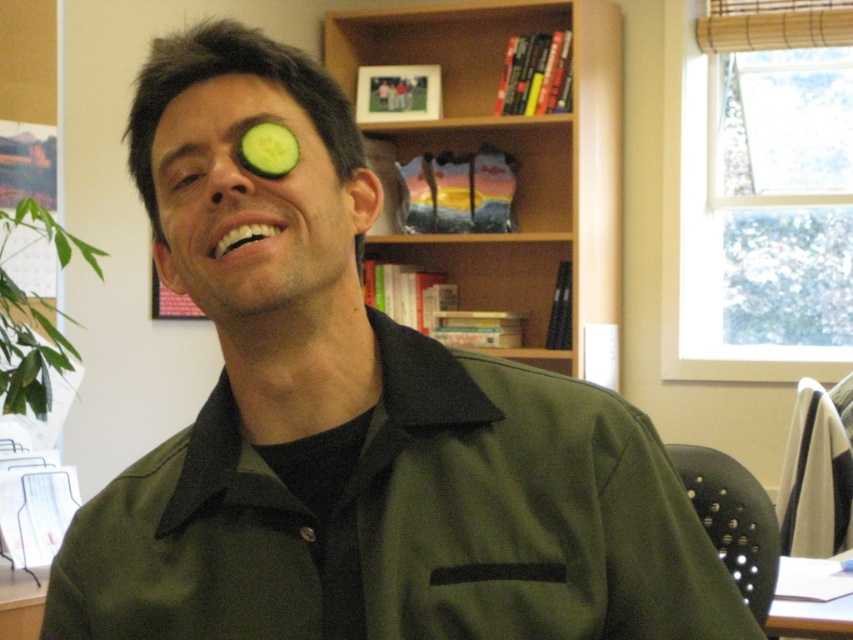
You are standing in an office and see a point marked at coordinates [250,205]. Based on the scene described, what object is located at that point?

The point at coordinates [250,205] corresponds to the green matte cucumber at upper left.

You are a photographer setting up for a photoshoot in this room. You need to ensure that the green smooth cucumber at left is visible in the shot without being blocked by the wooden bookshelf at upper center. Based on their positions, can you achieve this?

The wooden bookshelf at upper center is positioned over the green smooth cucumber at left, so if you place the camera at a lower angle, you can capture the cucumber while the bookshelf is above it and not blocking the view.

You are standing in the office and want to reach the wooden bookshelf at upper center. If your arm can extend 1.5 meters, can you reach it without moving closer?

The wooden bookshelf at upper center is 3.37 meters away from the camera, which is farther than your arm can reach. You would need to move closer to reach it.